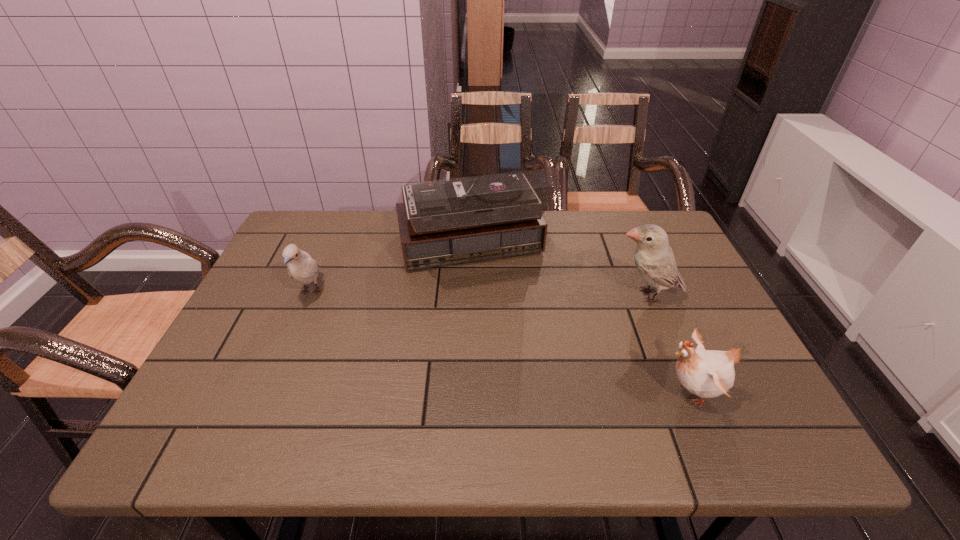
What are the coordinates of `vacant area at the right edge of the desktop` in the screenshot? It's located at (748, 368).

Image resolution: width=960 pixels, height=540 pixels. Find the location of `free space at the near left corner of the desktop`. free space at the near left corner of the desktop is located at coordinates (232, 418).

Identify the location of free space at the near right corner. This screenshot has height=540, width=960. (706, 430).

Locate an element on the screen. The width and height of the screenshot is (960, 540). unoccupied area between the nearest bird and the leftmost object is located at coordinates (501, 342).

Find the location of a particular element. The height and width of the screenshot is (540, 960). free space between the nearest bird and the leftmost object is located at coordinates (501, 342).

Identify the location of vacant point located between the tallest bird and the tallest object. (558, 274).

Identify the location of free spot between the leftmost object and the nearest object. The width and height of the screenshot is (960, 540). (501, 342).

This screenshot has height=540, width=960. In order to click on vacant region between the record player and the leftmost bird in this screenshot , I will do `click(391, 272)`.

Identify the location of vacant region between the leftmost object and the record player. (391, 272).

Identify the location of free space between the leftmost bird and the second tallest object. (479, 294).